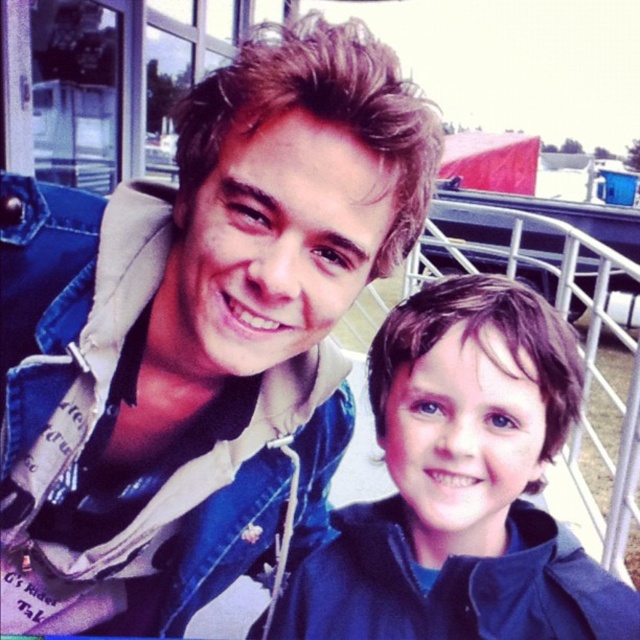
Looking at this image, who is more distant from viewer, (308, 468) or (420, 609)?

The point (308, 468) is behind.

Can you confirm if denim jacket at upper left is positioned to the left of matte blue jacket at lower right?

Indeed, denim jacket at upper left is positioned on the left side of matte blue jacket at lower right.

What are the coordinates of `denim jacket at upper left` in the screenshot? It's located at (196, 333).

Find the location of `denim jacket at upper left`. denim jacket at upper left is located at coordinates (196, 333).

This screenshot has height=640, width=640. What are the coordinates of `denim jacket at upper left` in the screenshot? It's located at (196, 333).

Between denim jacket at upper left and metallic silver rail at lower right, which one appears on the right side from the viewer's perspective?

Positioned to the right is metallic silver rail at lower right.

Identify the location of denim jacket at upper left. The width and height of the screenshot is (640, 640). (196, 333).

Where is `denim jacket at upper left`? Image resolution: width=640 pixels, height=640 pixels. denim jacket at upper left is located at coordinates (196, 333).

Is matte blue jacket at lower right further to camera compared to metallic silver rail at lower right?

No, it is not.

Does point (557, 618) lie behind point (600, 532)?

No, (557, 618) is in front of (600, 532).

Locate an element on the screen. matte blue jacket at lower right is located at coordinates (461, 484).